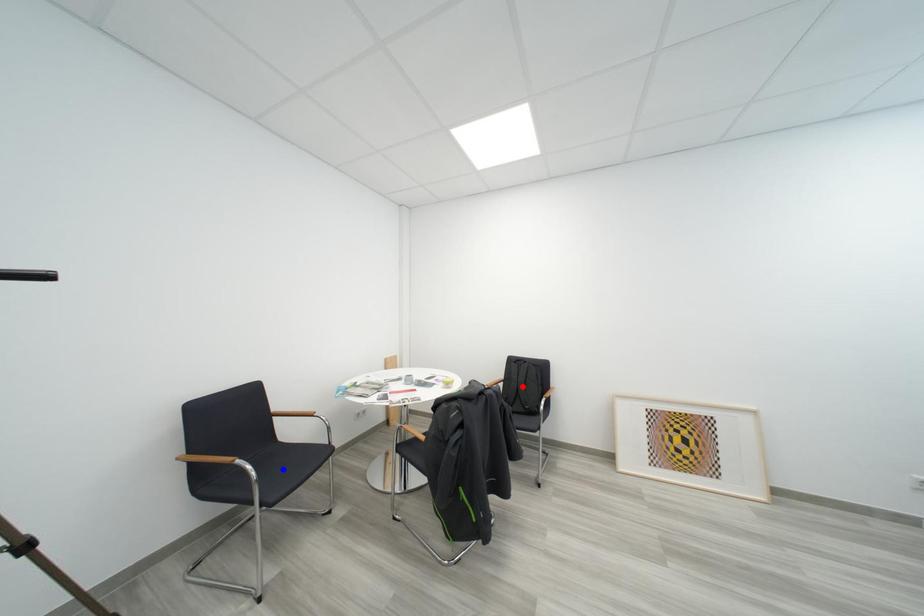
Question: Which of the two points in the image is closer to the camera?

Choices:
 (A) Blue point is closer.
 (B) Red point is closer.

Answer: (A)